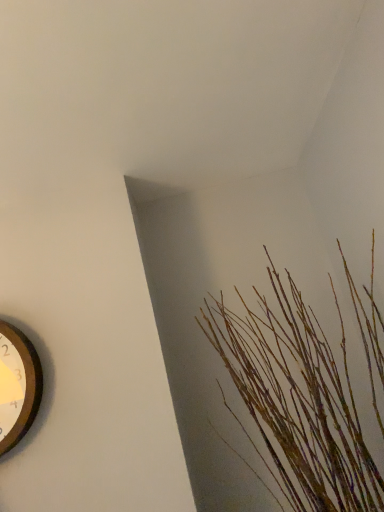
Question: From the image's perspective, is wooden clock at left on brown textured sticks at upper right?

Choices:
 (A) yes
 (B) no

Answer: (B)

Question: Would you say wooden clock at left contains brown textured sticks at upper right?

Choices:
 (A) yes
 (B) no

Answer: (B)

Question: Does wooden clock at left have a larger size compared to brown textured sticks at upper right?

Choices:
 (A) yes
 (B) no

Answer: (B)

Question: Does wooden clock at left have a lesser width compared to brown textured sticks at upper right?

Choices:
 (A) no
 (B) yes

Answer: (B)

Question: From the image's perspective, is wooden clock at left under brown textured sticks at upper right?

Choices:
 (A) yes
 (B) no

Answer: (A)

Question: Would you say wooden clock at left is outside brown textured sticks at upper right?

Choices:
 (A) yes
 (B) no

Answer: (A)

Question: Can you confirm if brown textured sticks at upper right is bigger than wooden clock at left?

Choices:
 (A) no
 (B) yes

Answer: (B)

Question: Is brown textured sticks at upper right thinner than wooden clock at left?

Choices:
 (A) yes
 (B) no

Answer: (B)

Question: From the image's perspective, does brown textured sticks at upper right appear lower than wooden clock at left?

Choices:
 (A) yes
 (B) no

Answer: (B)

Question: Does brown textured sticks at upper right have a greater width compared to wooden clock at left?

Choices:
 (A) no
 (B) yes

Answer: (B)

Question: Is brown textured sticks at upper right looking in the opposite direction of wooden clock at left?

Choices:
 (A) no
 (B) yes

Answer: (A)

Question: Are brown textured sticks at upper right and wooden clock at left far apart?

Choices:
 (A) yes
 (B) no

Answer: (B)

Question: Considering the positions of brown textured sticks at upper right and wooden clock at left in the image, is brown textured sticks at upper right taller or shorter than wooden clock at left?

Choices:
 (A) tall
 (B) short

Answer: (A)